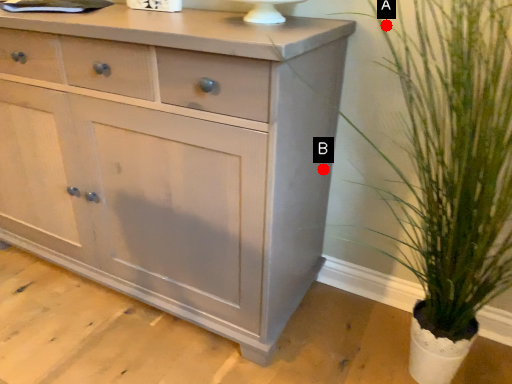
Question: Two points are circled on the image, labeled by A and B beside each circle. Which point is closer to the camera taking this photo?

Choices:
 (A) A is closer
 (B) B is closer

Answer: (A)